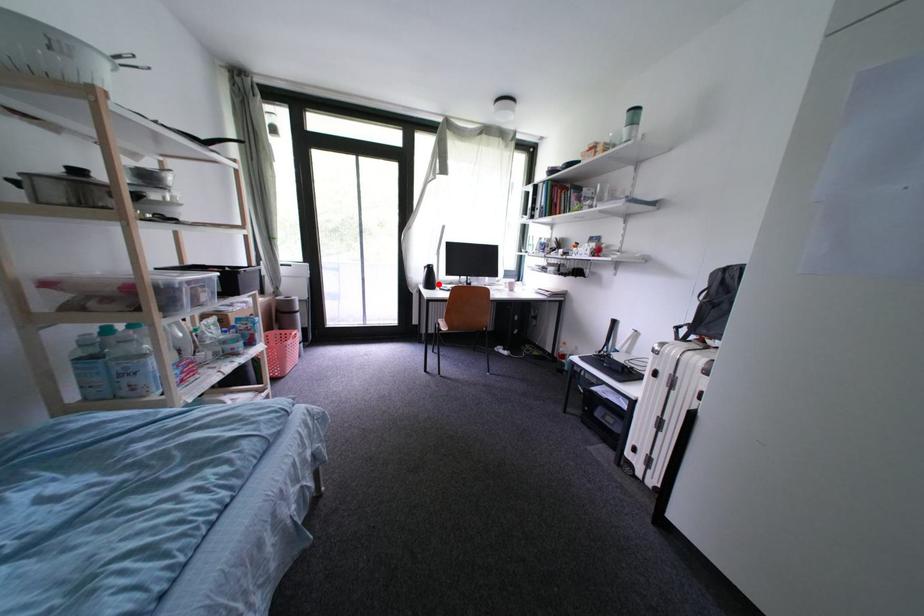
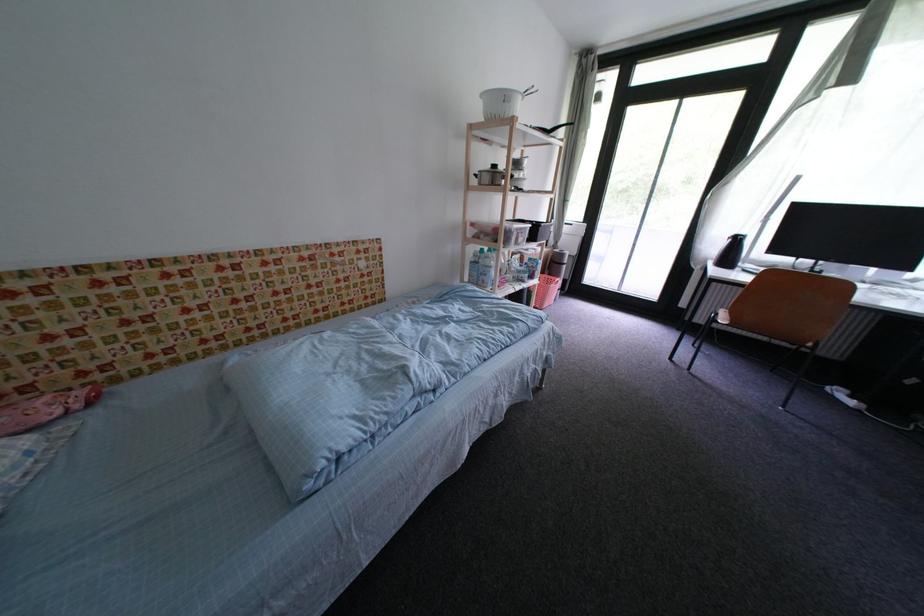
Find the pixel in the second image that matches the highlighted location in the first image.

(736, 261)